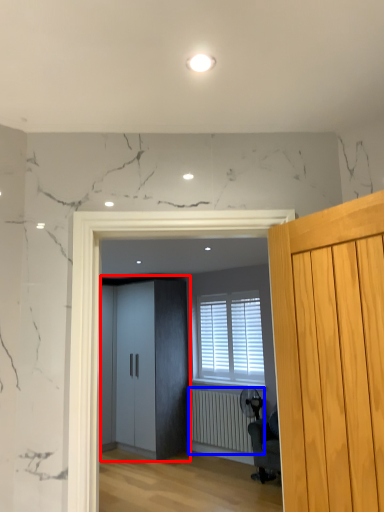
Question: Which object is further to the camera taking this photo, elevator (highlighted by a red box) or radiator (highlighted by a blue box)?

Choices:
 (A) elevator
 (B) radiator

Answer: (A)